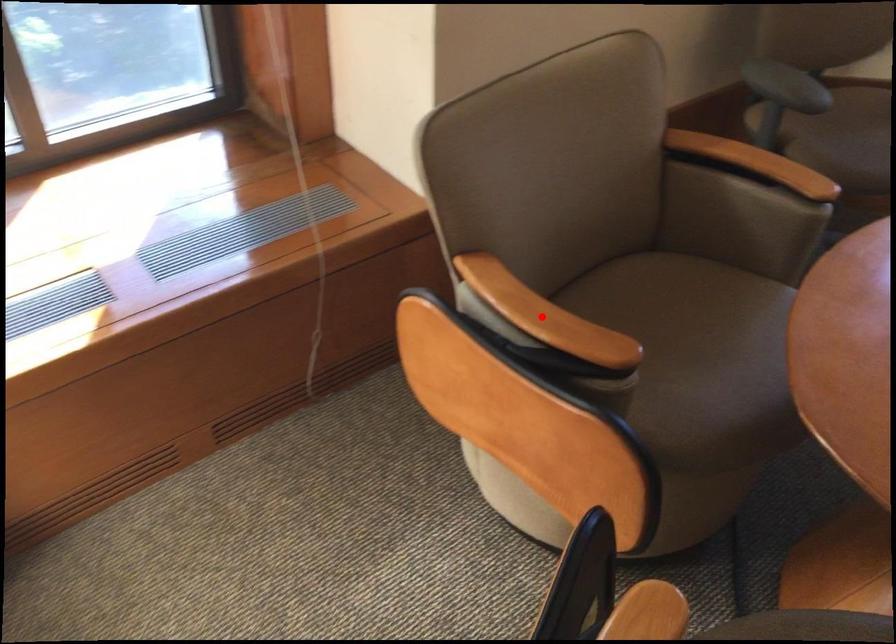
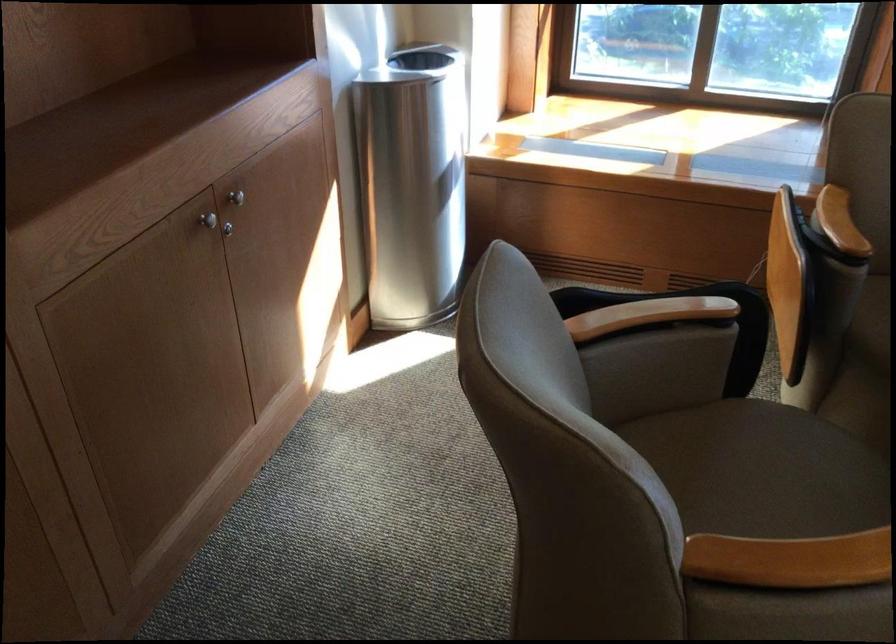
Where in the second image is the point corresponding to the highlighted location from the first image?

(839, 222)